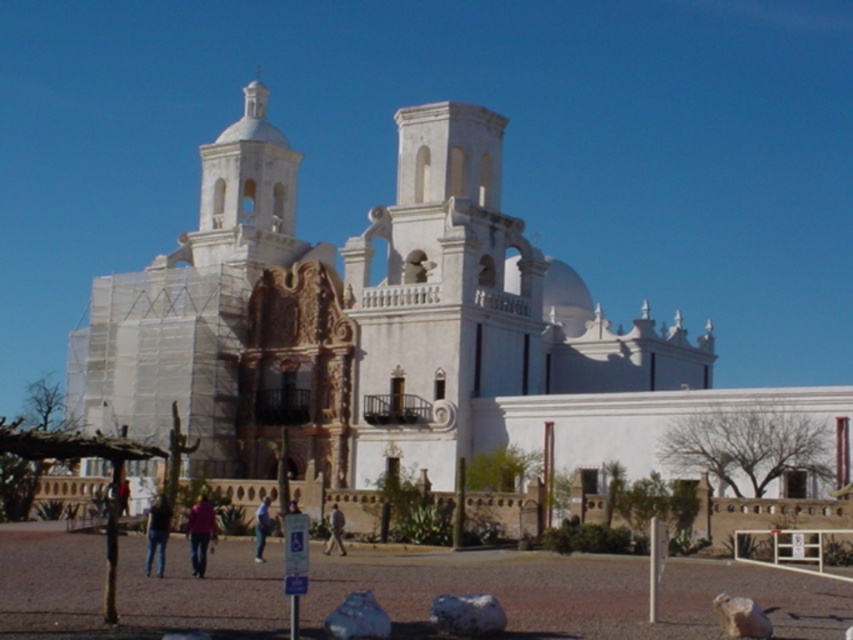
You are standing at the entrance of the historic white building and want to take a photo of the white stucco church at center and the jeans at lower center. Which object should you focus on first if you want to capture both in a single frame without moving the camera?

The white stucco church at center is bigger than the jeans at lower center, so you should focus on the white stucco church at center first to ensure it fills the frame appropriately before adjusting for the smaller jeans at lower center.

You are standing at the jeans at lower center location in the image. The white stucco church at center is under renovation with scaffolding on its left side. If you want to take a photo of the church without the scaffolding in the frame, which direction should you move to get a clear view?

To avoid the scaffolding on the left side of the white stucco church at center, you should move to the right side of the church. Since the scaffolding is only on the left, moving to the right would allow you to frame the church without the construction elements obstructing the view.